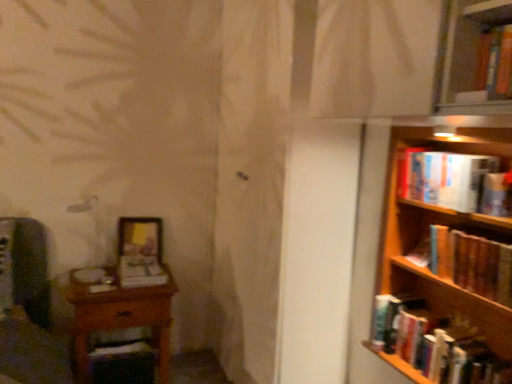
What are the coordinates of `empty space that is ontop of wooden table at left (from a real-world perspective)` in the screenshot? It's located at (111, 279).